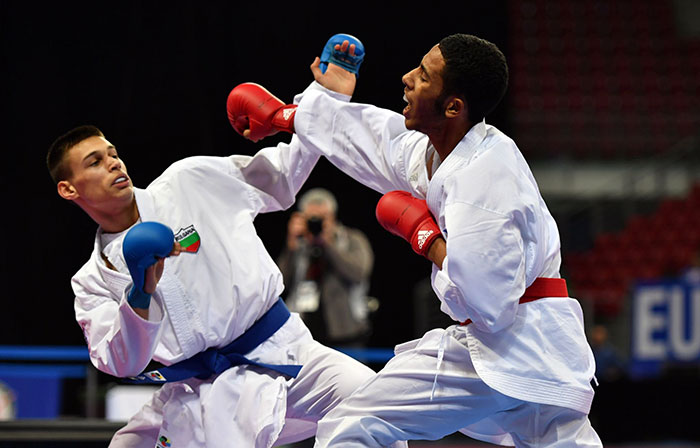
Image resolution: width=700 pixels, height=448 pixels. Find the location of `seats in background`. seats in background is located at coordinates (584, 104), (634, 114), (644, 237).